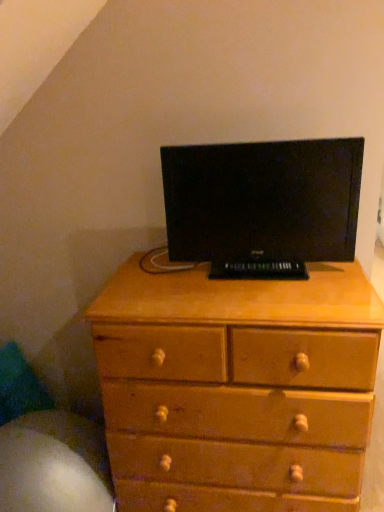
Identify the location of vacant area situated to the left side of black matte computer monitor at center. The height and width of the screenshot is (512, 384). (171, 287).